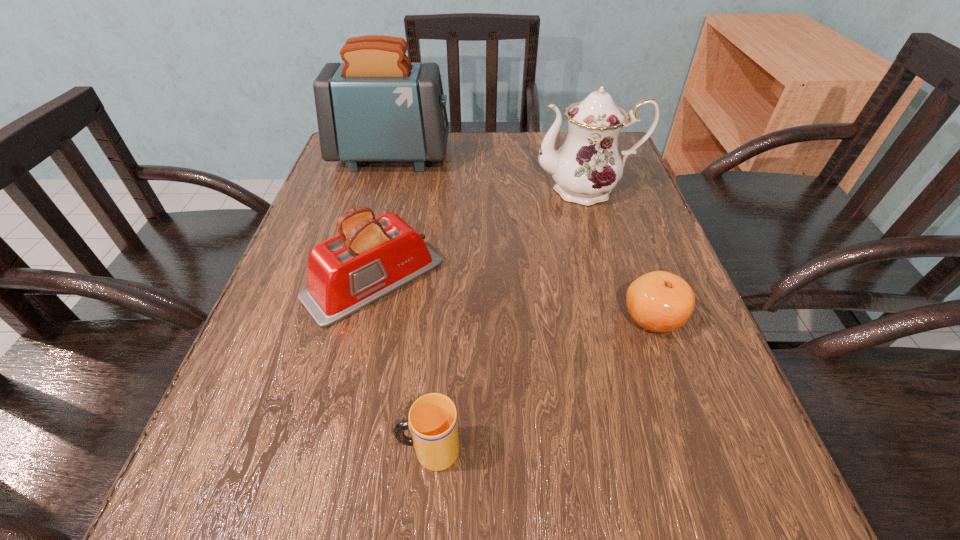
Find the location of a particular element. Image resolution: width=960 pixels, height=540 pixels. the taller toaster is located at coordinates (377, 106).

What are the coordinates of `chinaware` in the screenshot? It's located at click(x=586, y=168).

Locate an element on the screen. The height and width of the screenshot is (540, 960). the nearer toaster is located at coordinates (371, 257).

The height and width of the screenshot is (540, 960). I want to click on the third tallest object, so click(371, 257).

At what (x,y) coordinates should I click in order to perform the action: click on the nearest object. Please return your answer as a coordinate pair (x, y). Looking at the image, I should click on (433, 423).

Where is `clementine`? This screenshot has width=960, height=540. clementine is located at coordinates (659, 301).

At what (x,y) coordinates should I click in order to perform the action: click on free space located on the front-facing side of the taller toaster. Please return your answer as a coordinate pair (x, y). This screenshot has height=540, width=960. Looking at the image, I should click on (583, 157).

The width and height of the screenshot is (960, 540). Find the location of `blank area located on the left of the fourth shortest object`. blank area located on the left of the fourth shortest object is located at coordinates (406, 190).

Identify the location of free space located 0.190m on the right of the third tallest object. (544, 280).

The height and width of the screenshot is (540, 960). I want to click on vacant area situated on the side of the nearest object with the handle, so click(316, 450).